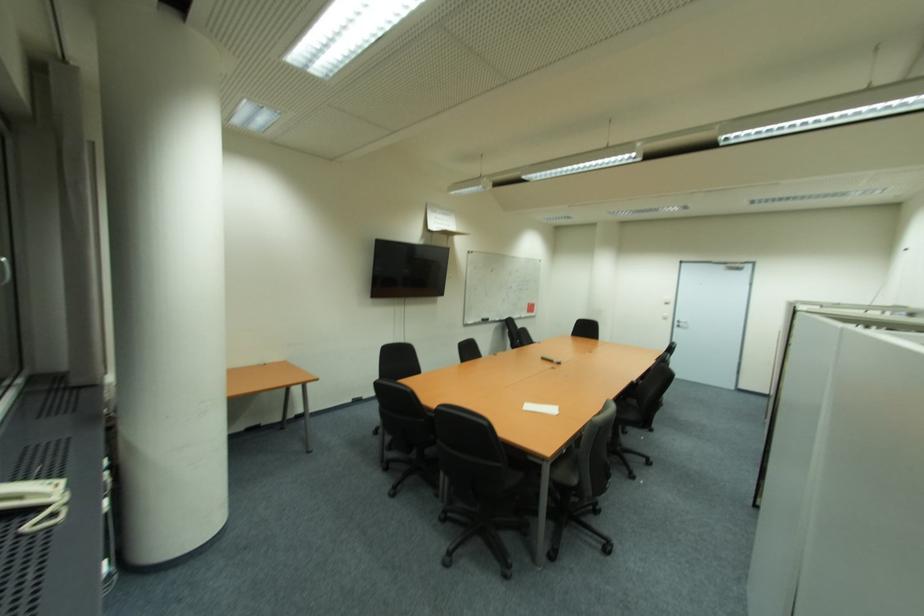
The image size is (924, 616). Identify the location of black chair sitting surface. (566, 468).